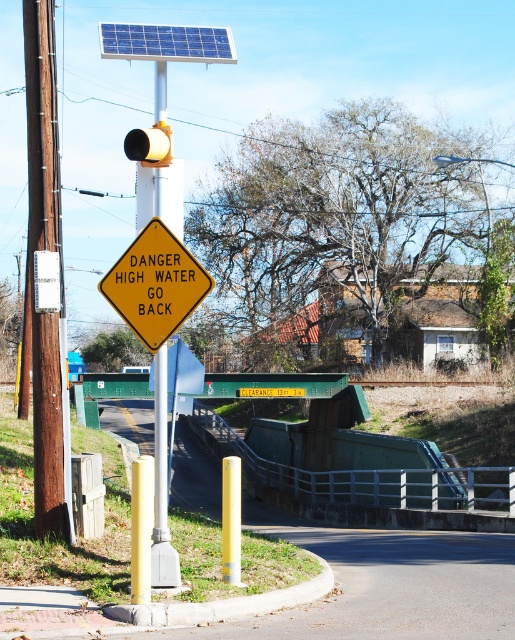
Question: Is metallic yellow pole at center to the right of blue textured solar panel at upper center from the viewer's perspective?

Choices:
 (A) no
 (B) yes

Answer: (A)

Question: Is metallic yellow pole at center above blue textured solar panel at upper center?

Choices:
 (A) no
 (B) yes

Answer: (A)

Question: Observing the image, what is the correct spatial positioning of yellow matte traffic sign at center in reference to blue textured solar panel at upper center?

Choices:
 (A) left
 (B) right

Answer: (B)

Question: Which object is positioned closest to the metallic yellow pole at center?

Choices:
 (A) yellow matte traffic sign at center
 (B) blue textured solar panel at upper center

Answer: (B)

Question: Among these objects, which one is nearest to the camera?

Choices:
 (A) yellow matte traffic sign at center
 (B) blue textured solar panel at upper center
 (C) metallic yellow pole at center

Answer: (C)

Question: Considering the real-world distances, which object is farthest from the yellow matte traffic sign at center?

Choices:
 (A) metallic yellow pole at center
 (B) blue textured solar panel at upper center

Answer: (A)